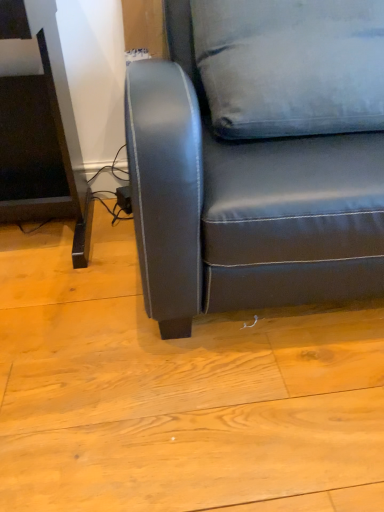
Image resolution: width=384 pixels, height=512 pixels. What do you see at coordinates (291, 66) in the screenshot?
I see `light blue fabric pillow at center` at bounding box center [291, 66].

Locate an element on the screen. light blue fabric pillow at center is located at coordinates (x=291, y=66).

You are a GUI agent. You are given a task and a screenshot of the screen. Output one action in this format:
    pyautogui.click(x=<x>, y=<y>)
    Task: Click on the light blue fabric pillow at center
    This screenshot has height=512, width=384.
    Given the screenshot: What is the action you would take?
    pyautogui.click(x=291, y=66)